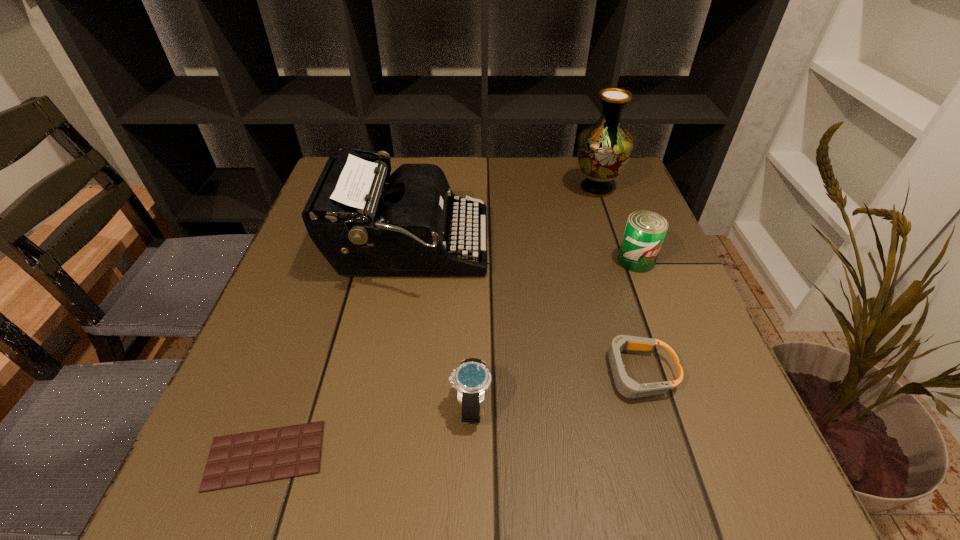
Where is `vase that is at the right edge`? vase that is at the right edge is located at coordinates (604, 148).

Find the location of `can located in the right edge section of the desktop`. can located in the right edge section of the desktop is located at coordinates (645, 231).

Locate an element on the screen. The image size is (960, 540). goggles located in the right edge section of the desktop is located at coordinates (626, 386).

Locate an element on the screen. This screenshot has height=540, width=960. object that is at the far left corner is located at coordinates (362, 226).

The height and width of the screenshot is (540, 960). Find the location of `object present at the near left corner`. object present at the near left corner is located at coordinates (248, 458).

I want to click on object at the far right corner, so click(604, 148).

In the image, there is a desktop. At what (x,y) coordinates should I click in order to perform the action: click on vacant space at the far edge. Please return your answer as a coordinate pair (x, y). This screenshot has height=540, width=960. Looking at the image, I should click on (517, 182).

Find the location of a particular element. This screenshot has height=540, width=960. vacant space at the left edge of the desktop is located at coordinates (247, 400).

Locate an element on the screen. free location at the right edge is located at coordinates (602, 234).

Image resolution: width=960 pixels, height=540 pixels. What are the coordinates of `vacant space at the far right corner of the desktop` in the screenshot? It's located at (582, 194).